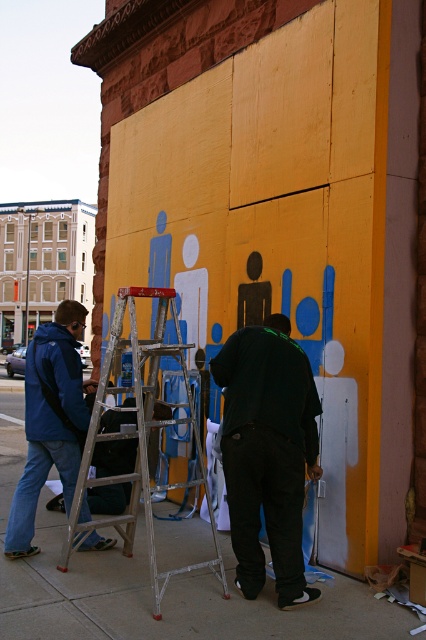
You are a delivery person who needs to move a large box from the sidewalk to the ladder. The box is 1.2 meters wide. Can you place the box on the concrete sidewalk at lower center without it overlapping the silver metallic ladder at center?

The concrete sidewalk at lower center might be wider than silver metallic ladder at center, so there is a possibility that the box can be placed without overlapping. However, since the exact width of the sidewalk isn not specified, it is recommended to measure or ensure sufficient space before placing the box.

What are the coordinates of the dark green shirt at center?

The dark green shirt at center is located at point (267, 452).

You are standing in front of the mural on the yellow wall. There is a specific point marked at coordinates point (x=288, y=332) on the wall. If you want to touch this point with a 1.8 meter long pole, will you be able to reach it?

The point (x=288, y=332) is 4.81 meters from the camera. Since the pole is only 1.8 meters long, you cannot reach the point as the distance is greater than the pole length.